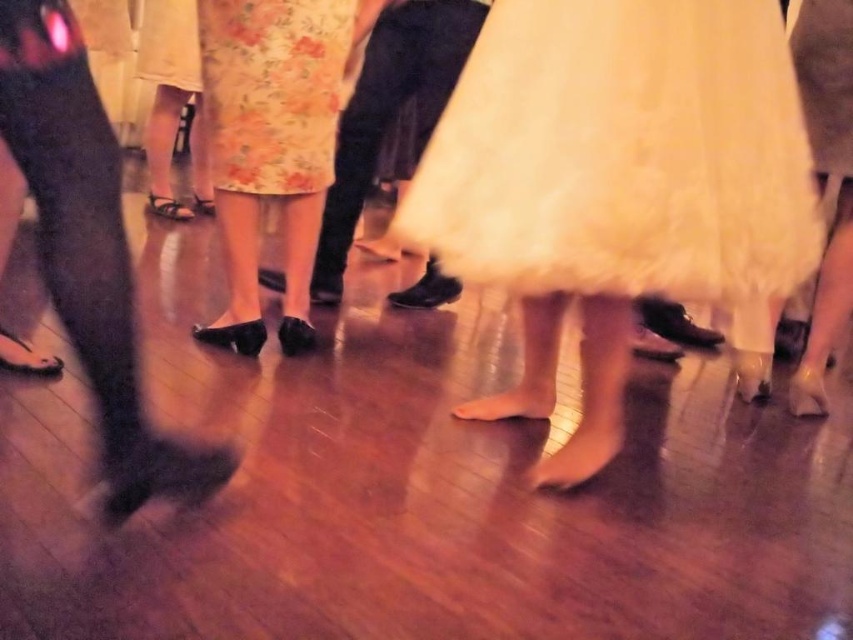
You are standing at the center of the image and want to move towards the floral fabric skirt at center. Which direction should you move to reach it?

Since the floral fabric skirt at center is located at point 0.227 on the x axis and 0.318 on the y axis, you should move towards the lower left direction to reach it.